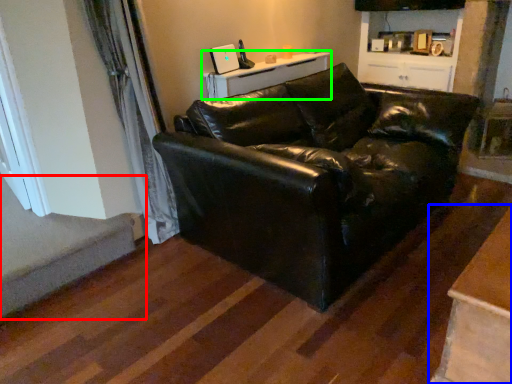
Question: Estimate the real-world distances between objects in this image. Which object is closer to stairwell (highlighted by a red box), table (highlighted by a blue box) or table (highlighted by a green box)?

Choices:
 (A) table
 (B) table

Answer: (B)